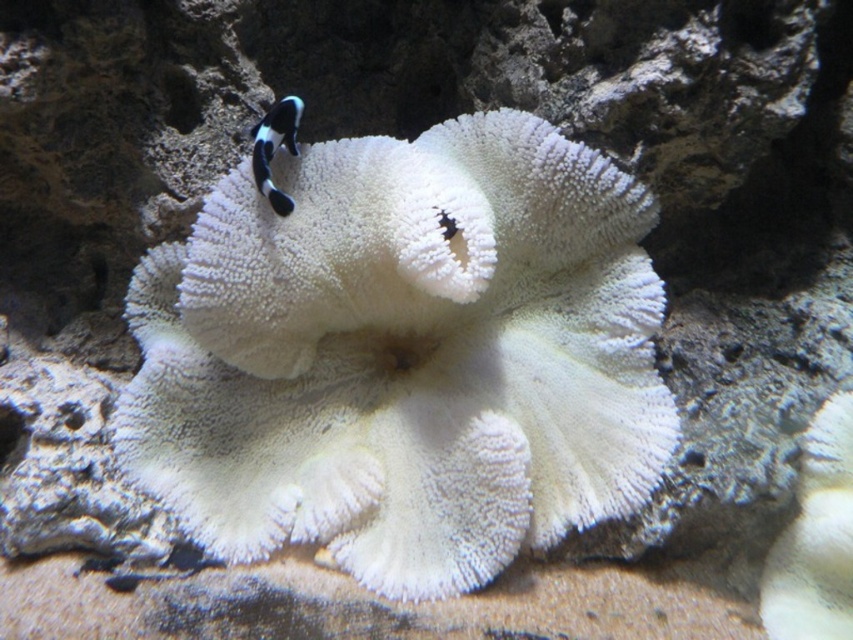
Consider the image. You are an underwater photographer aiming to capture both the white coral at center and the black and white striped fish at center in a single frame. Given their sizes, which one should you focus on to ensure both are in focus without adjusting your camera settings?

The white coral at center is much taller than the black and white striped fish at center, so focusing on the coral will help keep both in focus since it is larger and closer to the camera.

You are a marine biologist observing this underwater scene. You notice the white coral at center and the black and white striped fish at center. Which object is located to the right of the other?

The white coral at center is positioned on the right side of black and white striped fish at center, so the white coral at center is to the right of the black and white striped fish at center.

You are a marine biologist observing this underwater scene. You notice the white coral at center and the black and white striped fish at center. Based on their positions, can you determine which one is closer to the camera?

The white coral at center is located below the black and white striped fish at center, which means the fish is closer to the camera than the coral.